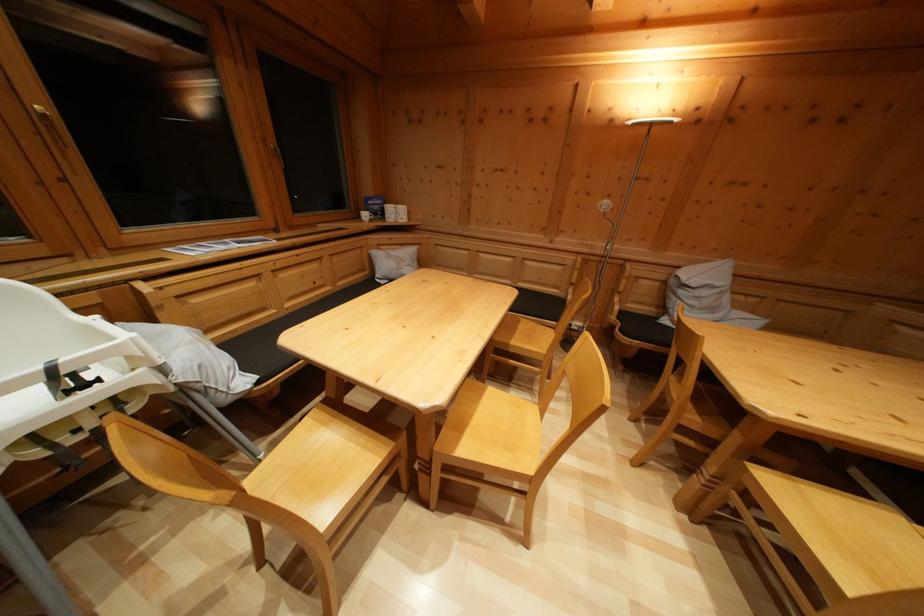
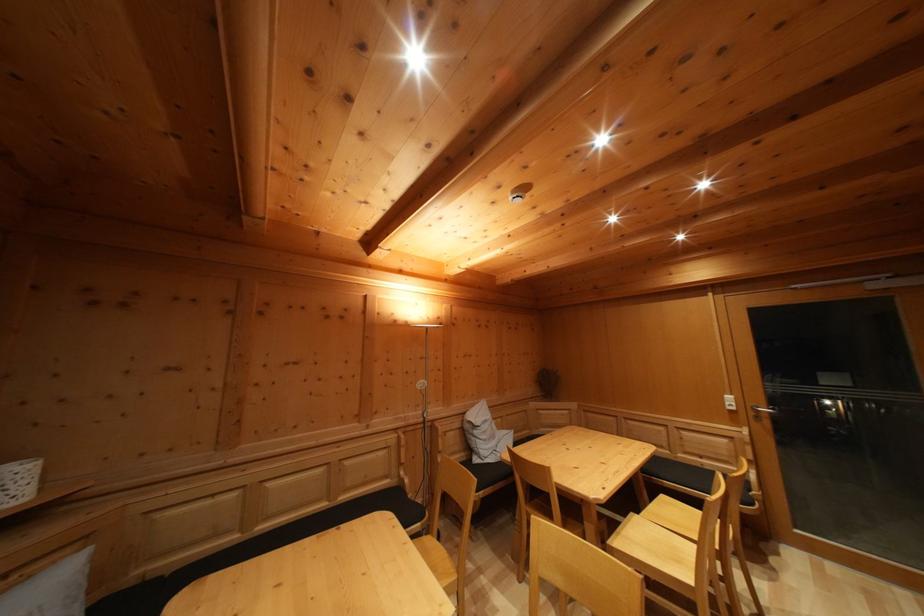
Based on the continuous images, in which direction is the camera rotating?

The camera rotated toward right-up.